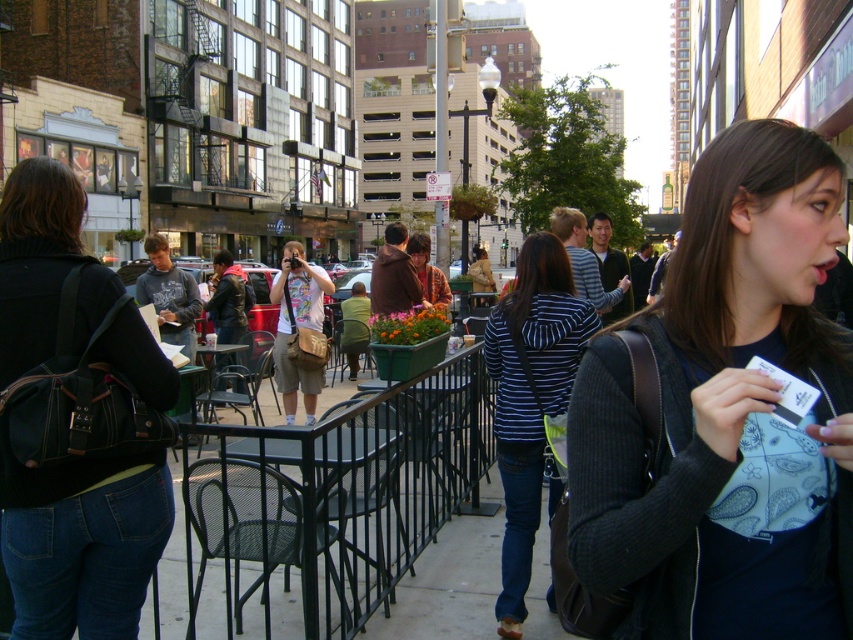
Between dark gray sweater at center and light blue cotton shirt at center, which one has more height?

Standing taller between the two is light blue cotton shirt at center.

Who is higher up, dark gray sweater at center or light blue cotton shirt at center?

Positioned higher is dark gray sweater at center.

I want to click on dark gray sweater at center, so click(726, 413).

Can you confirm if denim jeans at lower left is positioned to the left of striped fabric jacket at center?

Correct, you'll find denim jeans at lower left to the left of striped fabric jacket at center.

Who is more forward, [15,317] or [550,292]?

Point [15,317]

At what (x,y) coordinates should I click in order to perform the action: click on denim jeans at lower left. Please return your answer as a coordinate pair (x, y). This screenshot has width=853, height=640. Looking at the image, I should click on (74, 420).

Between point (28, 518) and point (224, 266), which one is positioned behind?

The point (224, 266) is more distant.

Is point (132, 582) more distant than point (239, 314)?

No, it is in front of (239, 314).

Does point (82, 422) come behind point (236, 266)?

No, (82, 422) is in front of (236, 266).

Where is `denim jeans at lower left`? denim jeans at lower left is located at coordinates (74, 420).